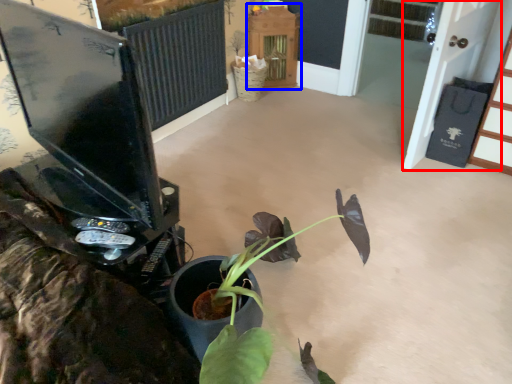
Question: Which point is further to the camera, screen door (highlighted by a red box) or furniture (highlighted by a blue box)?

Choices:
 (A) screen door
 (B) furniture

Answer: (B)